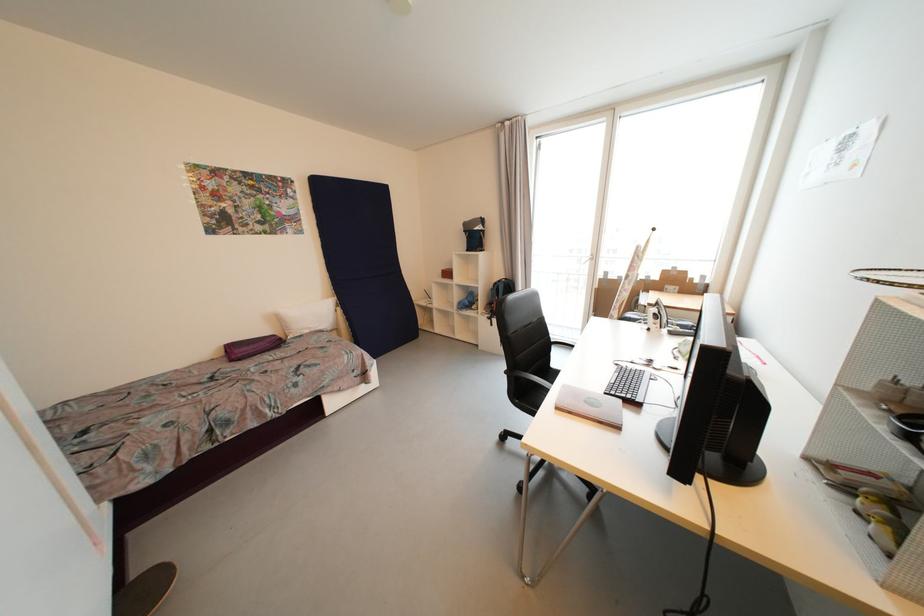
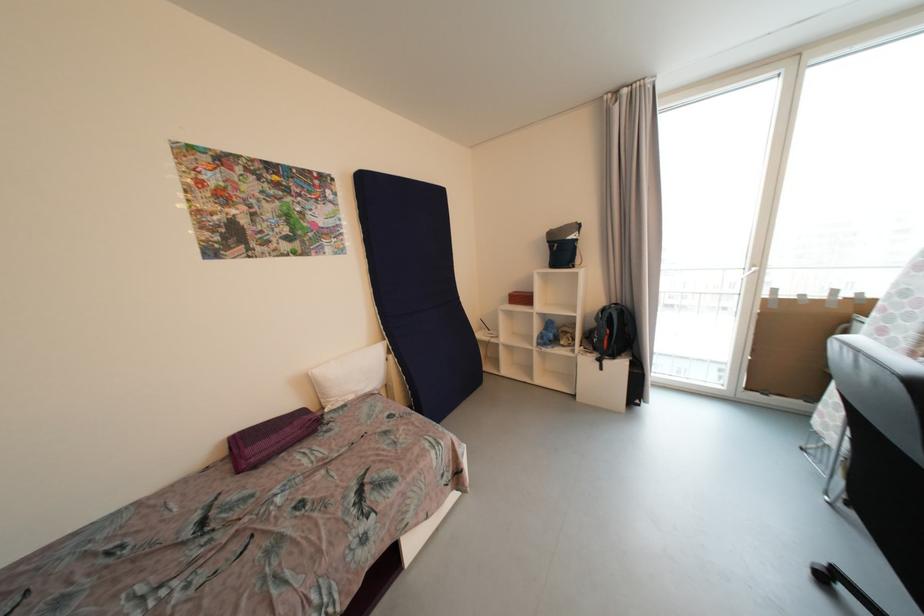
The point at (501,285) is marked in the first image. Where is the corresponding point in the second image?

(608, 312)